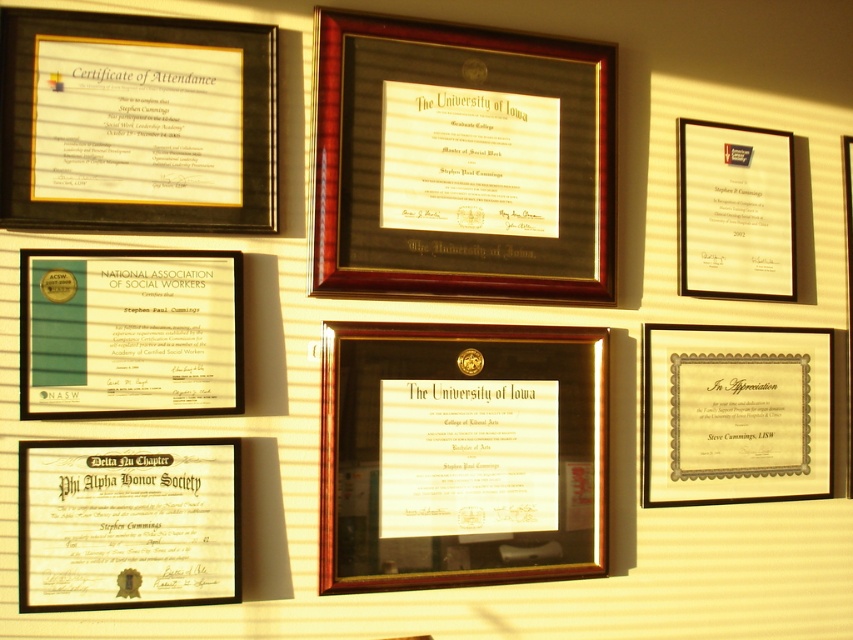
Measure the distance between gold/metallic picture frame at center and matte black certificate at upper right.

gold/metallic picture frame at center is 35.79 centimeters from matte black certificate at upper right.

The width and height of the screenshot is (853, 640). Identify the location of gold/metallic picture frame at center. (460, 454).

In order to click on gold/metallic picture frame at center in this screenshot , I will do `click(460, 454)`.

Is point (399, 465) less distant than point (83, 304)?

No, (399, 465) is behind (83, 304).

Which is more to the left, gold/metallic picture frame at center or green paper certificate at lower left?

Positioned to the left is green paper certificate at lower left.

Locate an element on the screen. gold/metallic picture frame at center is located at coordinates (460, 454).

What are the coordinates of `gold/metallic picture frame at center` in the screenshot? It's located at (460, 454).

Who is positioned more to the right, black matte certificate at upper left or gold/metallic frame at center?

From the viewer's perspective, gold/metallic frame at center appears more on the right side.

Is black matte certificate at upper left behind gold/metallic frame at center?

No.

The height and width of the screenshot is (640, 853). I want to click on black matte certificate at upper left, so click(135, 122).

Find the location of a particular element. Image resolution: width=853 pixels, height=640 pixels. black matte certificate at upper left is located at coordinates point(135,122).